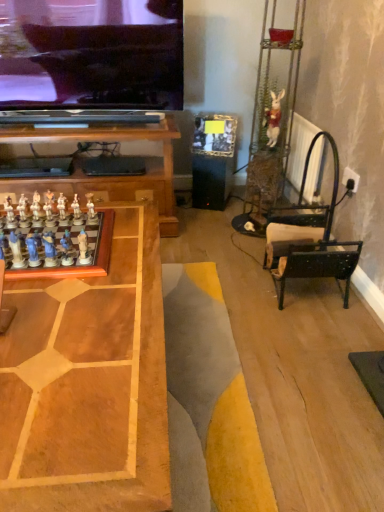
I want to click on free spot to the right of matte blue chess pieces at left, placed as the 9th toy when sorted from right to left, so click(73, 276).